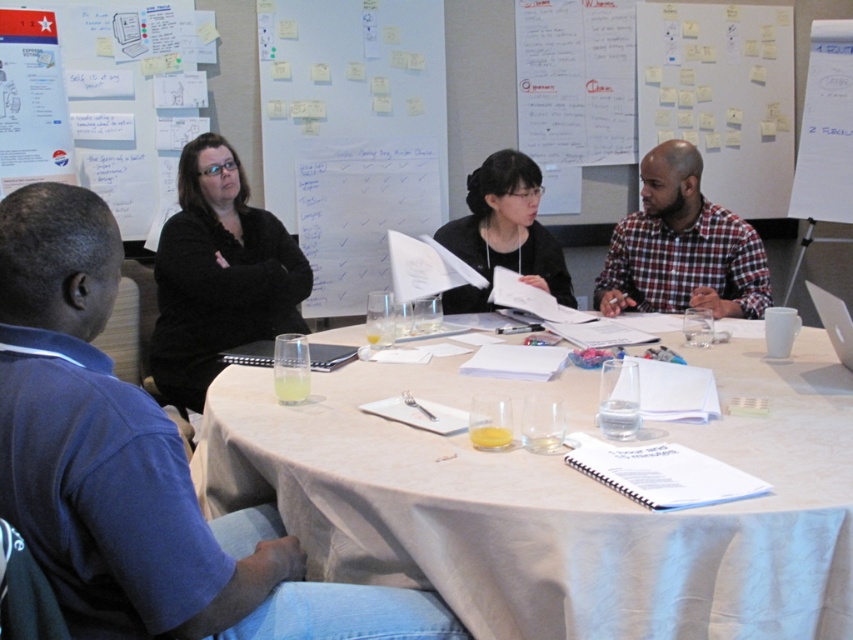
Can you confirm if white textured table at center is wider than black matte/black paper at center?

Correct, the width of white textured table at center exceeds that of black matte/black paper at center.

Is point (223, 458) less distant than point (445, 227)?

Yes.

You are a GUI agent. You are given a task and a screenshot of the screen. Output one action in this format:
    pyautogui.click(x=<x>, y=<y>)
    Task: Click on the white textured table at center
    
    Given the screenshot: What is the action you would take?
    pyautogui.click(x=556, y=502)

Can you confirm if white textured table at center is smaller than black matte shirt at upper left?

No.

Does white textured table at center lie behind black matte shirt at upper left?

That is False.

Between point (805, 376) and point (178, 168), which one is positioned in front?

Positioned in front is point (805, 376).

Locate an element on the screen. This screenshot has width=853, height=640. white textured table at center is located at coordinates (556, 502).

Describe the element at coordinates (556, 502) in the screenshot. The image size is (853, 640). I see `white textured table at center` at that location.

This screenshot has width=853, height=640. Describe the element at coordinates (556, 502) in the screenshot. I see `white textured table at center` at that location.

Where is `white textured table at center`? white textured table at center is located at coordinates (556, 502).